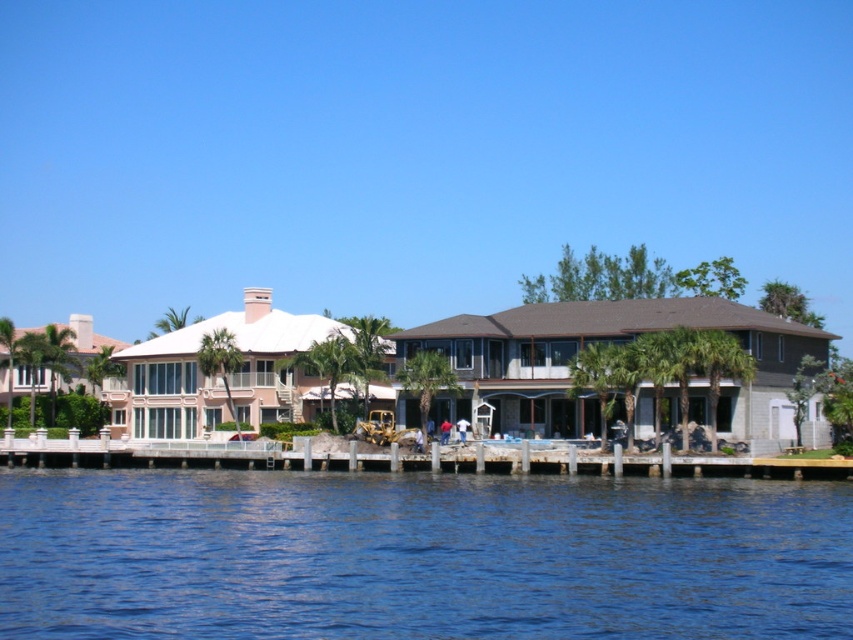
Does blue water at lower center appear on the right side of white concrete dock at lower center?

No, blue water at lower center is not to the right of white concrete dock at lower center.

Between blue water at lower center and white concrete dock at lower center, which one appears on the right side from the viewer's perspective?

white concrete dock at lower center is more to the right.

Who is more forward, (158, 592) or (564, 456)?

Point (158, 592) is more forward.

Image resolution: width=853 pixels, height=640 pixels. I want to click on blue water at lower center, so click(419, 556).